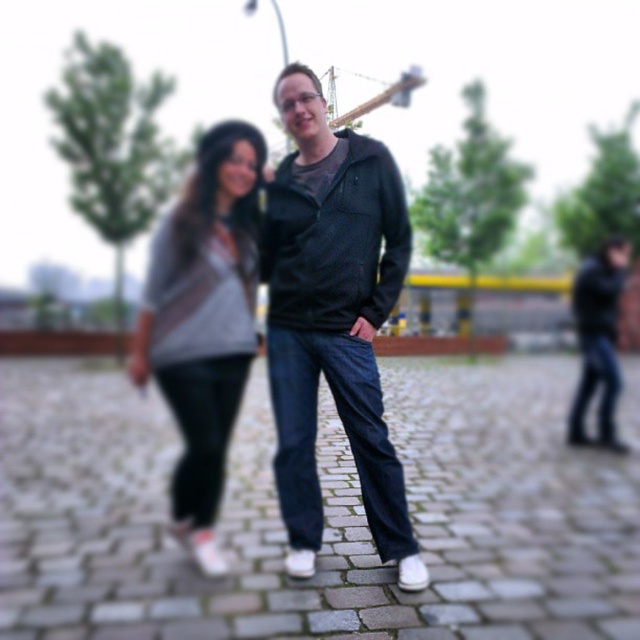
Is matte black jacket at center bigger than matte gray sweater at center?

Actually, matte black jacket at center might be smaller than matte gray sweater at center.

Which of these two, matte black jacket at center or matte gray sweater at center, stands shorter?

matte gray sweater at center

Which is behind, point (316, 472) or point (256, 216)?

Positioned behind is point (256, 216).

At what (x,y) coordinates should I click in order to perform the action: click on matte black jacket at center. Please return your answer as a coordinate pair (x, y). The image size is (640, 640). Looking at the image, I should click on (332, 317).

Who is more forward, (x=394, y=522) or (x=611, y=401)?

Positioned in front is point (x=394, y=522).

Is matte black jacket at center to the left of dark blue jeans at right from the viewer's perspective?

Yes, matte black jacket at center is to the left of dark blue jeans at right.

Between point (300, 346) and point (604, 330), which one is positioned in front?

Positioned in front is point (300, 346).

Where is `matte black jacket at center`? The height and width of the screenshot is (640, 640). matte black jacket at center is located at coordinates (332, 317).

Which is in front, point (189, 442) or point (614, 448)?

Positioned in front is point (189, 442).

Does point (224, 404) come farther from viewer compared to point (602, 332)?

That is False.

Does point (246, 131) come closer to viewer compared to point (614, 403)?

Yes, it is in front of point (614, 403).

Identify the location of matte gray sweater at center. The image size is (640, 640). (204, 321).